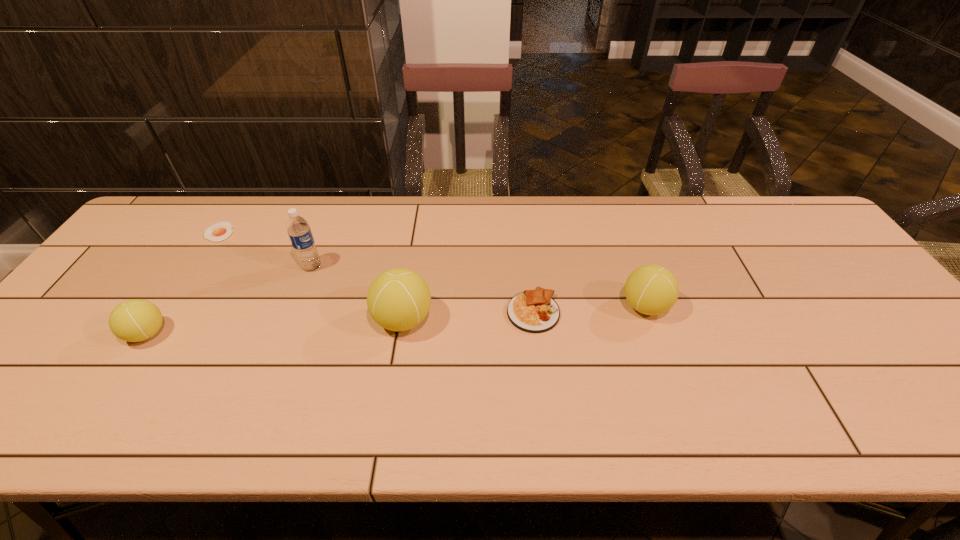
You are a GUI agent. You are given a task and a screenshot of the screen. Output one action in this format:
    pyautogui.click(x=<x>, y=<y>)
    Task: Click on the free space between the egg yolk and the tallest object
    The height and width of the screenshot is (540, 960).
    Given the screenshot: What is the action you would take?
    pyautogui.click(x=265, y=249)

This screenshot has width=960, height=540. What are the coordinates of `vacant point located between the third object from right to left and the leftmost tennis ball` in the screenshot? It's located at [276, 327].

Locate an element on the screen. the second closest object to the second tennis ball from left to right is located at coordinates (298, 229).

Find the location of a particular element. This screenshot has width=960, height=540. object that stands as the third closest to the omelet is located at coordinates (298, 229).

This screenshot has height=540, width=960. Find the location of `tennis ball that stands as the third closest to the farthest object`. tennis ball that stands as the third closest to the farthest object is located at coordinates (651, 289).

Identify which tennis ball is the second closest to the tallest tennis ball. Please provide its 2D coordinates. Your answer should be formatted as a tuple, i.e. [(x, y)], where the tuple contains the x and y coordinates of a point satisfying the conditions above.

[(135, 320)]

Locate an element on the screen. vacant space that satisfies the following two spatial constraints: 1. on the back side of the leftmost tennis ball; 2. on the left side of the water bottle is located at coordinates (192, 266).

Image resolution: width=960 pixels, height=540 pixels. In order to click on vacant region that satisfies the following two spatial constraints: 1. on the front side of the fourth object from left to right; 2. on the left side of the egg yolk in this screenshot , I will do `click(161, 320)`.